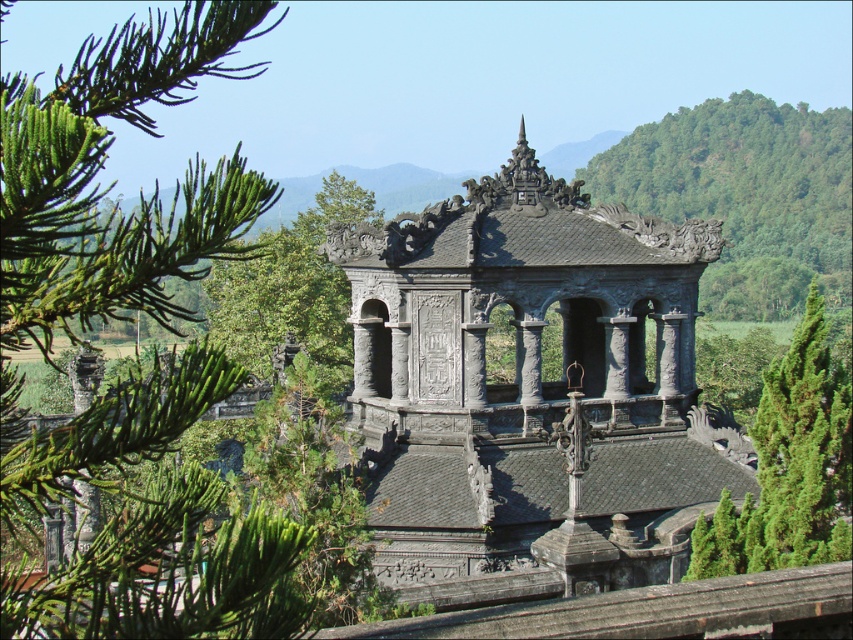
You are an architect visiting this traditional East Asian pavilion. You notice two trees in the scene. Which tree, the green leafy tree at upper right or the green textured tree at right, is larger in size?

The green leafy tree at upper right is larger than the green textured tree at right.

You are standing at the entrance of the traditional East Asian pavilion and notice a point marked at coordinates (746, 195). What object is located at this point?

The point at coordinates (746, 195) marks a green leafy tree at the upper right.

You are standing in front of the traditional East Asian pavilion or temple. You notice two points marked on the roof structure. The first point is at coordinates point (x=648, y=518) and the second is at point (x=815, y=362). Which of these two points is closer to you?

Point (x=648, y=518) is closer to you because it is further to the viewer than point (x=815, y=362).